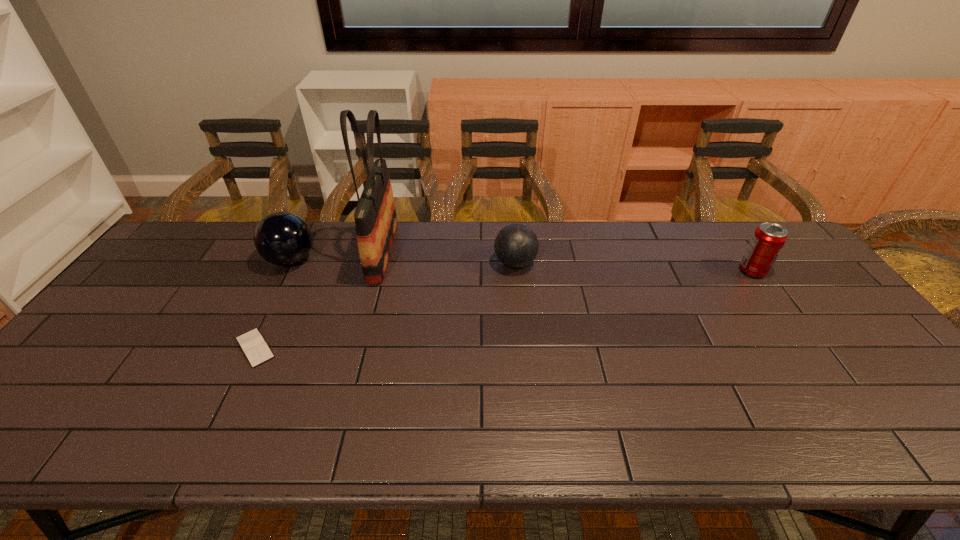
Identify the location of free space between the nearest object and the soda can. Image resolution: width=960 pixels, height=540 pixels. (504, 309).

This screenshot has width=960, height=540. Find the location of `vacant point located between the right bowling ball and the tallest object`. vacant point located between the right bowling ball and the tallest object is located at coordinates pyautogui.click(x=449, y=258).

The width and height of the screenshot is (960, 540). What are the coordinates of `free point between the shorter bowling ball and the diary` in the screenshot? It's located at (385, 306).

You are a GUI agent. You are given a task and a screenshot of the screen. Output one action in this format:
    pyautogui.click(x=<x>, y=<y>)
    Task: Click on the empty location between the fourth object from left to right and the diary
    
    Given the screenshot: What is the action you would take?
    pyautogui.click(x=385, y=306)

Where is `free space between the soda can and the tallest object`? free space between the soda can and the tallest object is located at coordinates (567, 261).

At what (x,y) coordinates should I click in order to perform the action: click on the third closest object to the nearest object. Please return your answer as a coordinate pair (x, y). Looking at the image, I should click on (516, 245).

Identify the location of object that stands as the second closest to the tallest object. (253, 345).

Identify the location of free space in the image that satisfies the following two spatial constraints: 1. on the grip area of the fourth object from left to right; 2. on the back side of the rightmost object. This screenshot has height=540, width=960. (516, 271).

At what (x,y) coordinates should I click in order to perform the action: click on vacant area that satisfies the following two spatial constraints: 1. on the back side of the soda can; 2. on the grip area of the right bowling ball. Please return your answer as a coordinate pair (x, y). This screenshot has width=960, height=540. Looking at the image, I should click on (747, 264).